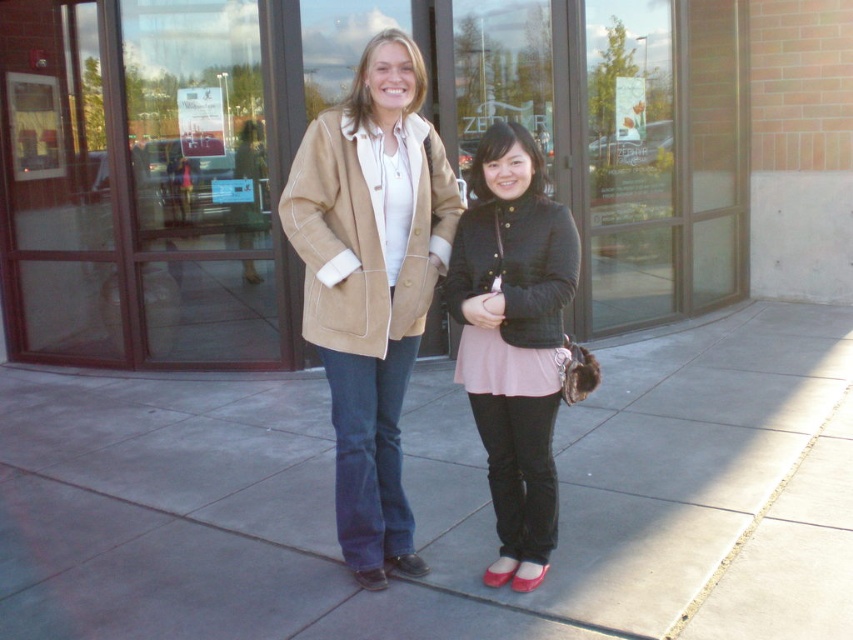
Question: Is matte black jacket at center below tan suede coat at center?

Choices:
 (A) no
 (B) yes

Answer: (B)

Question: Which of the following is the closest to the observer?

Choices:
 (A) click(448, 273)
 (B) click(409, 244)

Answer: (B)

Question: Is transparent glass door at upper left above matte black jacket at center?

Choices:
 (A) no
 (B) yes

Answer: (B)

Question: Which object is farther from the camera taking this photo?

Choices:
 (A) tan suede coat at center
 (B) gray concrete sidewalk at center

Answer: (A)

Question: Can you confirm if gray concrete sidewalk at center is positioned to the left of transparent glass door at upper left?

Choices:
 (A) yes
 (B) no

Answer: (B)

Question: Which point is closer to the camera?

Choices:
 (A) gray concrete sidewalk at center
 (B) tan suede coat at center

Answer: (A)